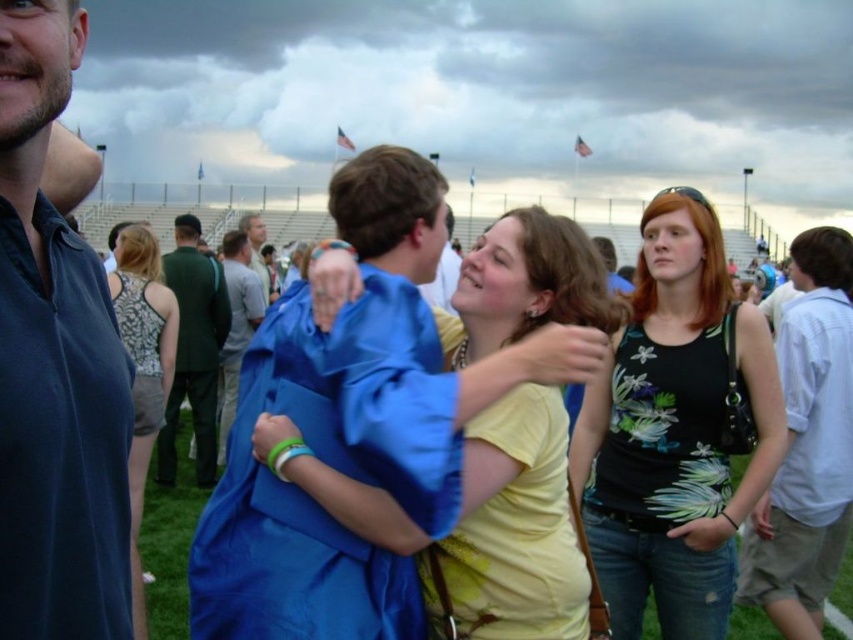
You are a photographer at a graduation ceremony. You need to capture a photo of the two people at center. The yellow matte shirt at center and the printed fabric tank top at center are overlapping. Which clothing item is shorter and might be less likely to cover the other in the photo?

The yellow matte shirt at center is shorter than the printed fabric tank top at center, so it is less likely to cover the other in the photo.

You are standing at the point closer to the camera in this image. Which point are you at, point (x=196, y=420) or point (x=131, y=353)?

You are at point (x=196, y=420) because it is further to the camera than point (x=131, y=353).